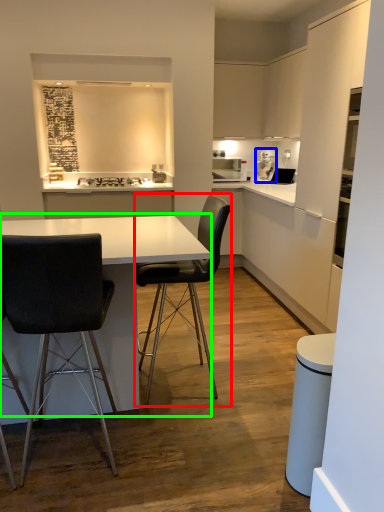
Question: Based on their relative distances, which object is nearer to chair (highlighted by a red box)? Choose from coffee machine (highlighted by a blue box) and table (highlighted by a green box).

Choices:
 (A) coffee machine
 (B) table

Answer: (B)